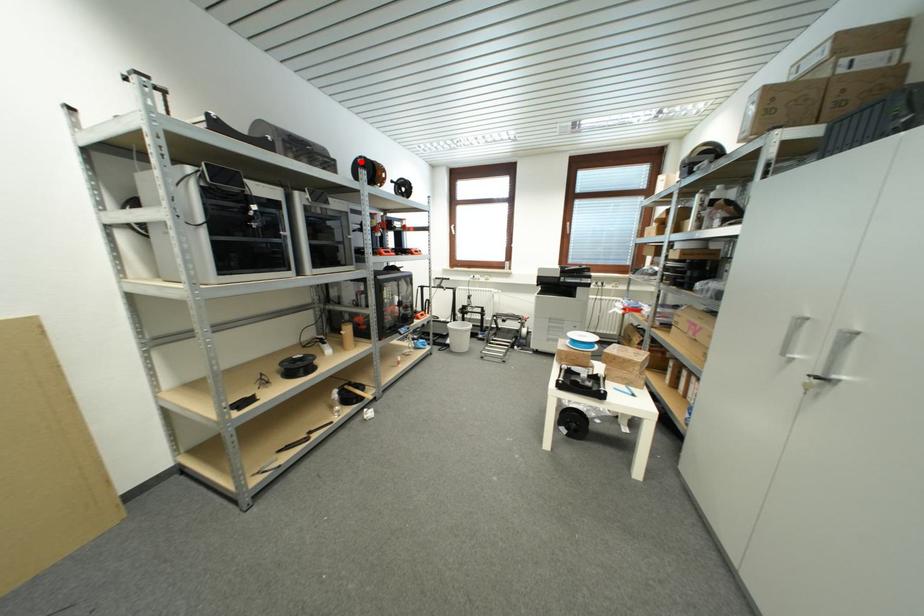
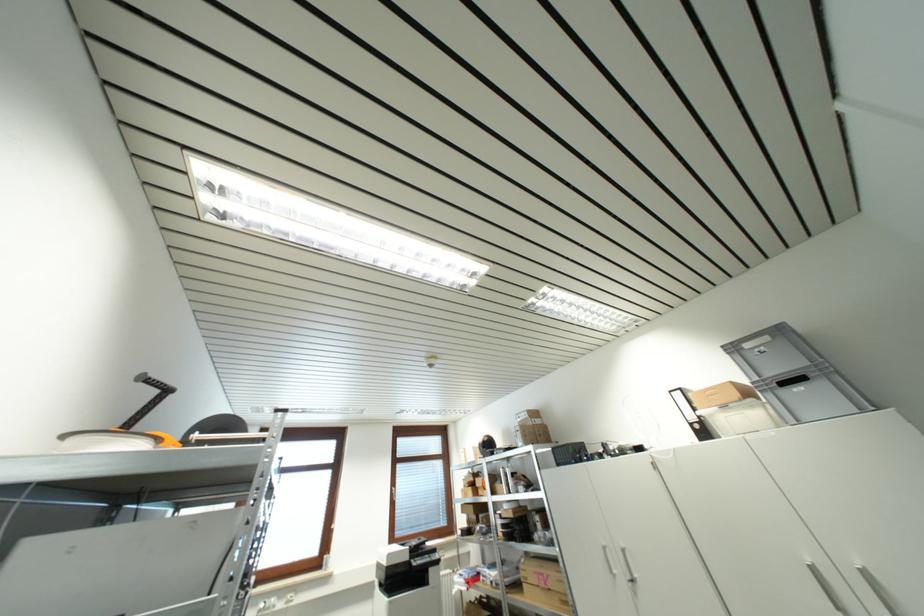
Question: I am providing you with two images of the same scene from different viewpoints. A red point is marked on the first image. At the location where the point appears in image 1, is it still visible in image 2?

Choices:
 (A) Yes
 (B) No

Answer: (B)